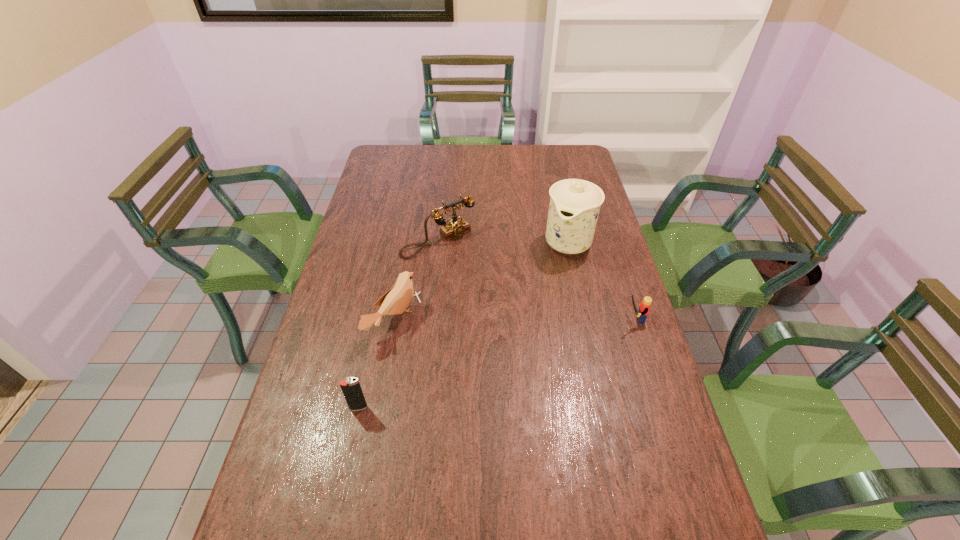
The width and height of the screenshot is (960, 540). Find the location of `object that is the nearest to the tallest object`. object that is the nearest to the tallest object is located at coordinates (644, 308).

Where is `vacant region that satisfies the following two spatial constraints: 1. on the front side of the telephone; 2. on the front-facing side of the rightmost object`? The image size is (960, 540). vacant region that satisfies the following two spatial constraints: 1. on the front side of the telephone; 2. on the front-facing side of the rightmost object is located at coordinates (431, 319).

This screenshot has width=960, height=540. What are the coordinates of `vacant space that satisfies the following two spatial constraints: 1. on the front side of the tallest object; 2. on the front-facing side of the rightmost object` in the screenshot? It's located at (584, 319).